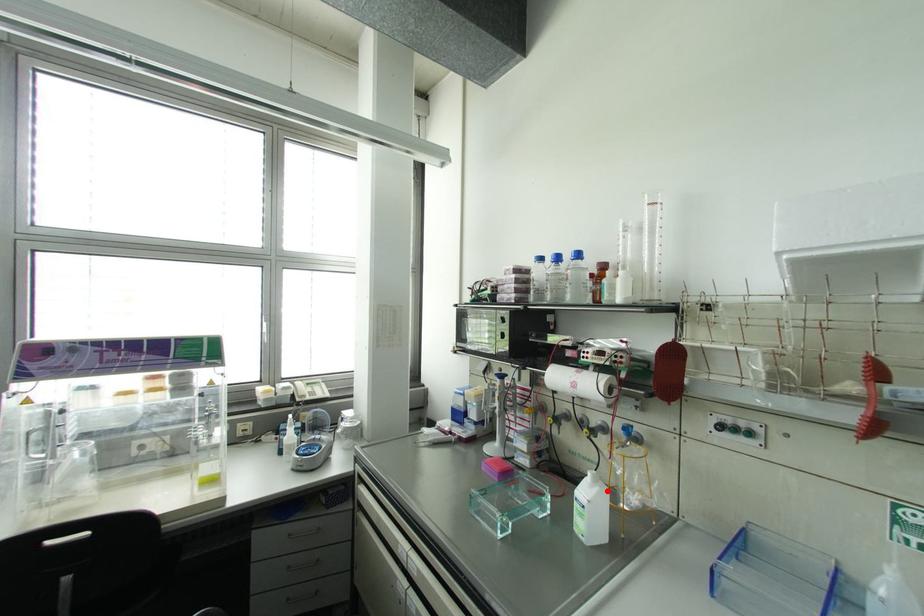
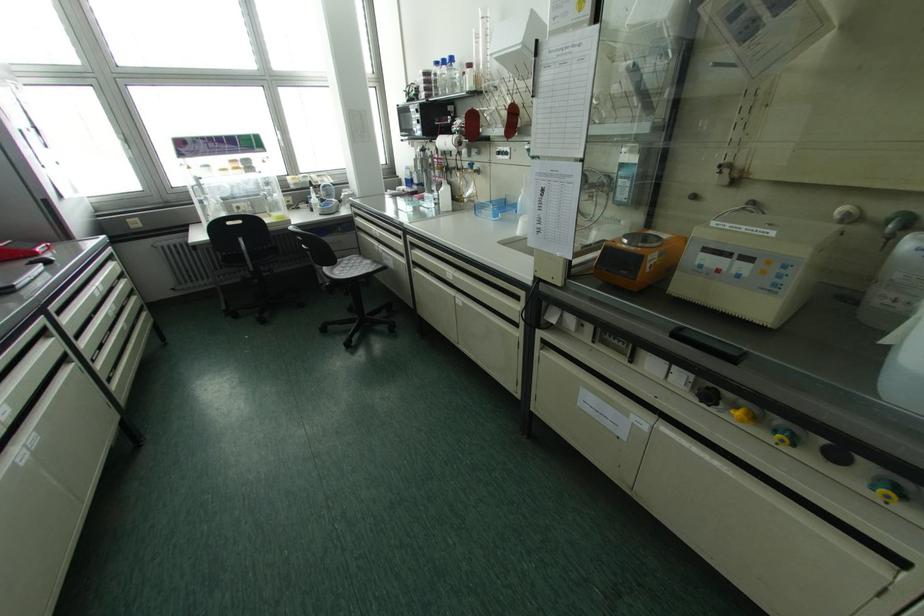
Question: A red point is marked in image1. In image2, is the corresponding 3D point closer to the camera or farther? Reply with the corresponding letter.

Choices:
 (A) The corresponding 3D point is closer.
 (B) The corresponding 3D point is farther.

Answer: (A)